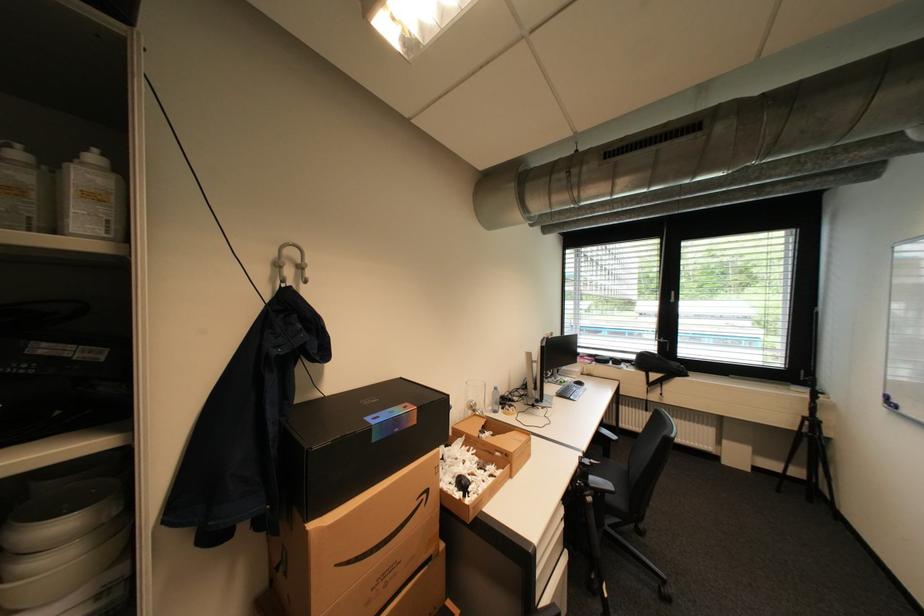
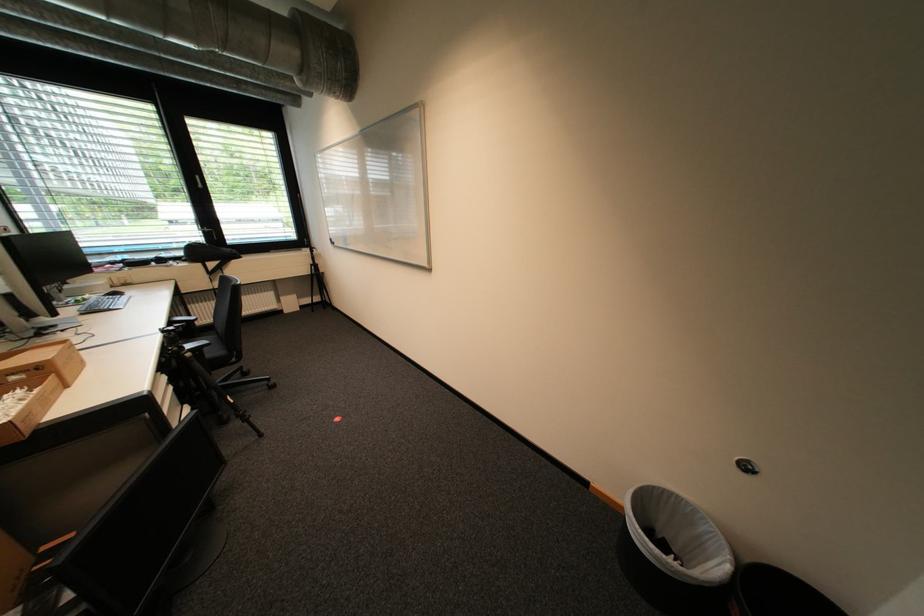
Where in the second image is the point corresponding to (591,485) from the first image?

(185, 349)